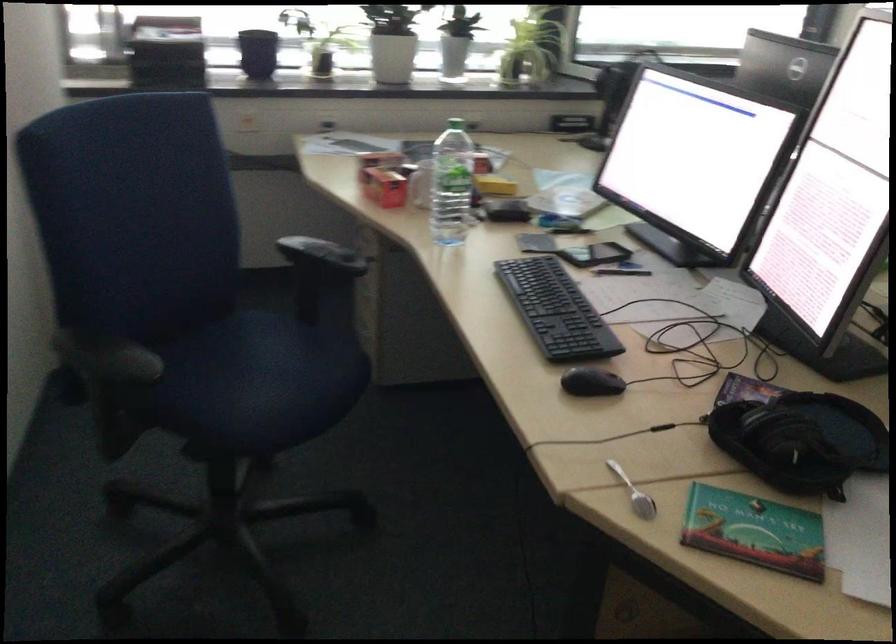
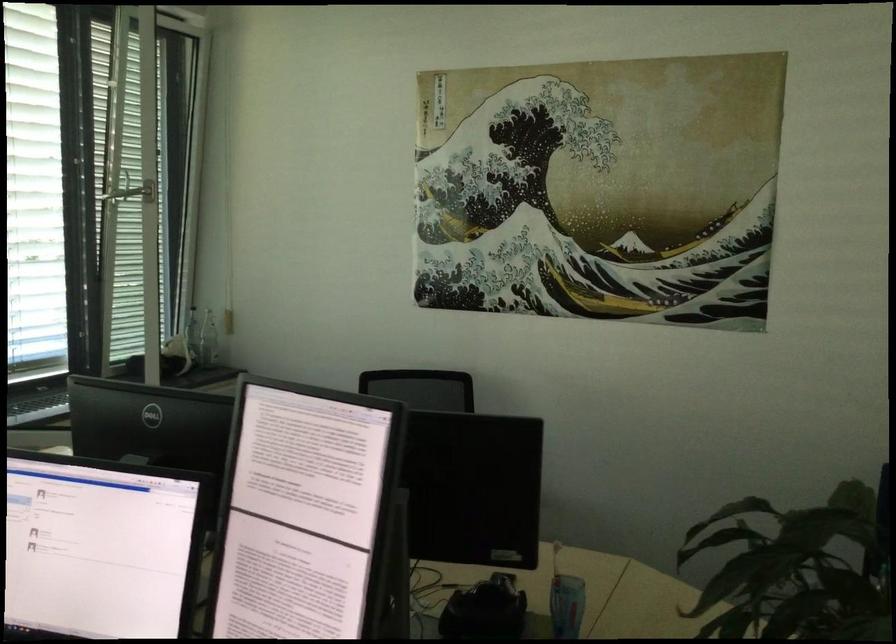
Question: The camera is either moving clockwise (left) or counter-clockwise (right) around the object. The first image is from the beginning of the video and the second image is from the end. Is the camera moving left or right when shooting the video?

Choices:
 (A) Left
 (B) Right

Answer: (A)